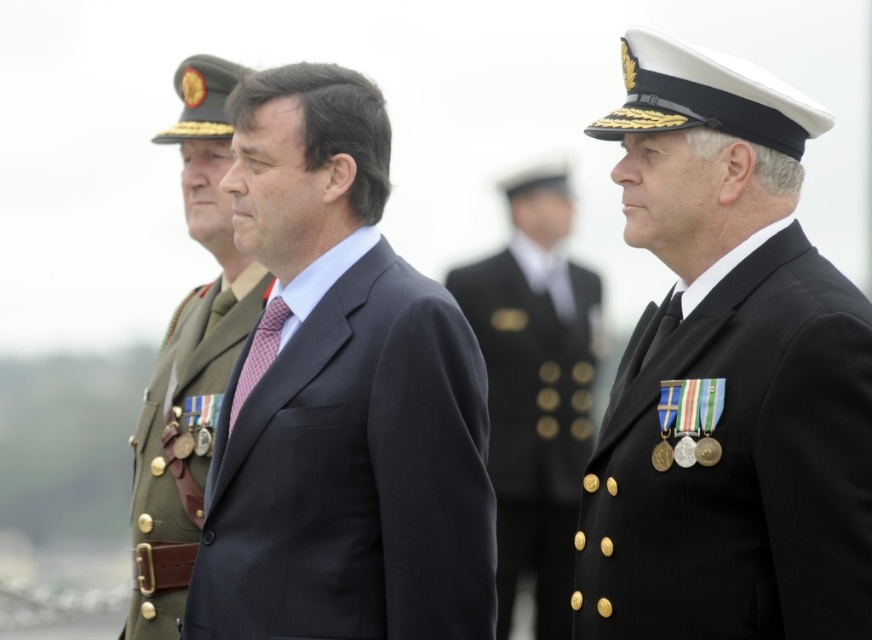
Question: In this image, where is green military uniform at left located relative to pink woven tie at center?

Choices:
 (A) below
 (B) above

Answer: (B)

Question: Can you confirm if matte black suit at center is positioned above green military uniform at left?

Choices:
 (A) yes
 (B) no

Answer: (B)

Question: Which is nearer to the black woolen suit at center?

Choices:
 (A) green military uniform at left
 (B) matte black suit at center
 (C) pink woven tie at center

Answer: (B)

Question: Which point is farther from the camera taking this photo?

Choices:
 (A) (393, 516)
 (B) (478, 296)
 (C) (266, 272)

Answer: (B)

Question: Is shiny gold buttons at center smaller than green military uniform at left?

Choices:
 (A) no
 (B) yes

Answer: (B)

Question: Considering the real-world distances, which object is farthest from the shiny gold buttons at center?

Choices:
 (A) black woolen suit at center
 (B) matte black suit at center
 (C) green military uniform at left

Answer: (A)